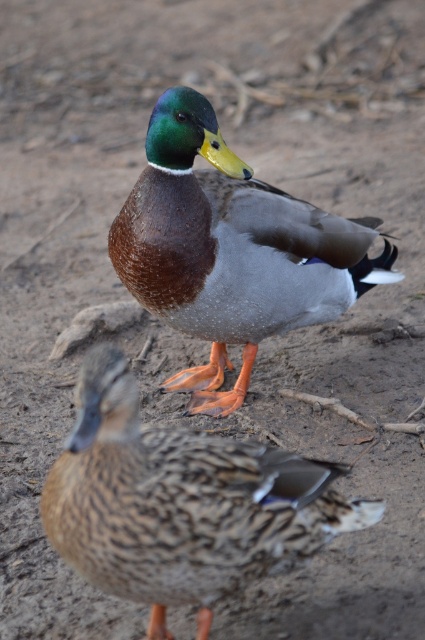
Question: Can you confirm if brown speckled duck at lower left is positioned above shiny brown duck at center?

Choices:
 (A) yes
 (B) no

Answer: (B)

Question: Does brown speckled duck at lower left have a lesser width compared to shiny brown duck at center?

Choices:
 (A) yes
 (B) no

Answer: (A)

Question: Which point is closer to the camera?

Choices:
 (A) shiny brown duck at center
 (B) brown speckled duck at lower left

Answer: (B)

Question: Observing the image, what is the correct spatial positioning of brown speckled duck at lower left in reference to shiny brown duck at center?

Choices:
 (A) above
 (B) below

Answer: (B)

Question: Which point is farther to the camera?

Choices:
 (A) (257, 252)
 (B) (291, 548)

Answer: (A)